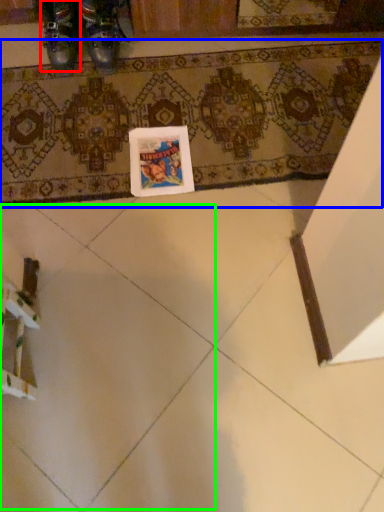
Question: Which object is the farthest from footwear (highlighted by a red box)? Choose among these: bath mat (highlighted by a blue box) or ceramic tile (highlighted by a green box).

Choices:
 (A) bath mat
 (B) ceramic tile

Answer: (B)